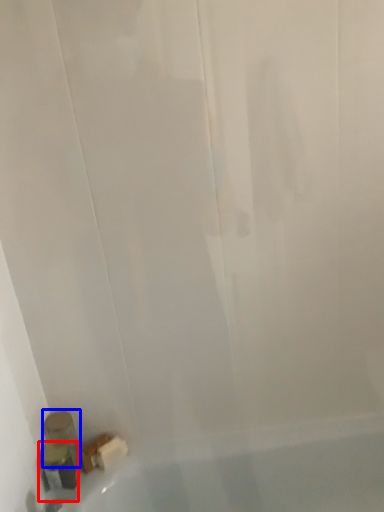
Question: Among these objects, which one is nearest to the camera, toiletry (highlighted by a red box) or toiletry (highlighted by a blue box)?

Choices:
 (A) toiletry
 (B) toiletry

Answer: (A)